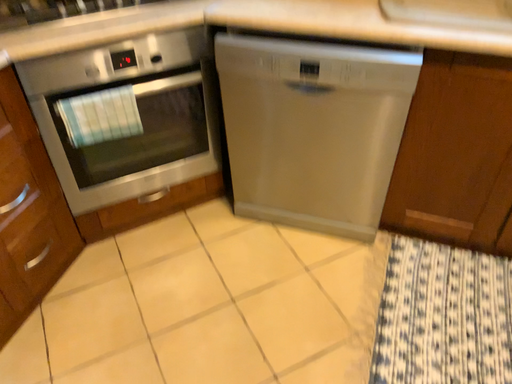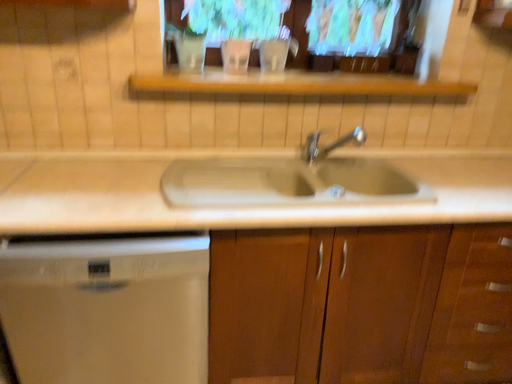
Question: Which way did the camera rotate in the video?

Choices:
 (A) rotated downward
 (B) rotated upward

Answer: (B)